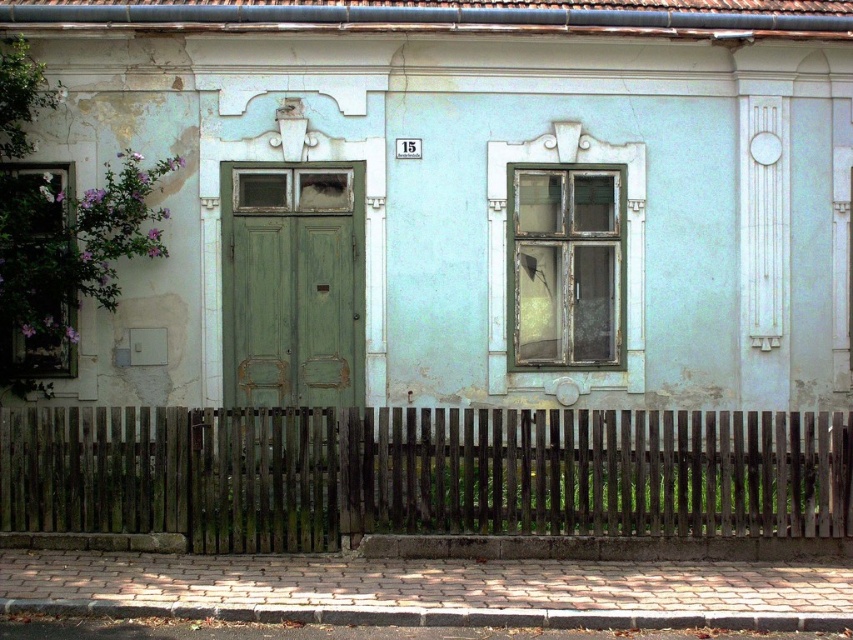
Question: Can you confirm if weathered wood fence at lower center is thinner than green matte door at center?

Choices:
 (A) no
 (B) yes

Answer: (A)

Question: Can you confirm if weathered wood fence at lower center is positioned to the right of green matte door at center?

Choices:
 (A) yes
 (B) no

Answer: (A)

Question: Which object is closer to the camera taking this photo?

Choices:
 (A) weathered wood fence at lower center
 (B) green matte door at center

Answer: (A)

Question: Among these objects, which one is farthest from the camera?

Choices:
 (A) green matte door at center
 (B) weathered wood fence at lower center

Answer: (A)

Question: Is weathered wood fence at lower center thinner than green matte door at center?

Choices:
 (A) no
 (B) yes

Answer: (A)